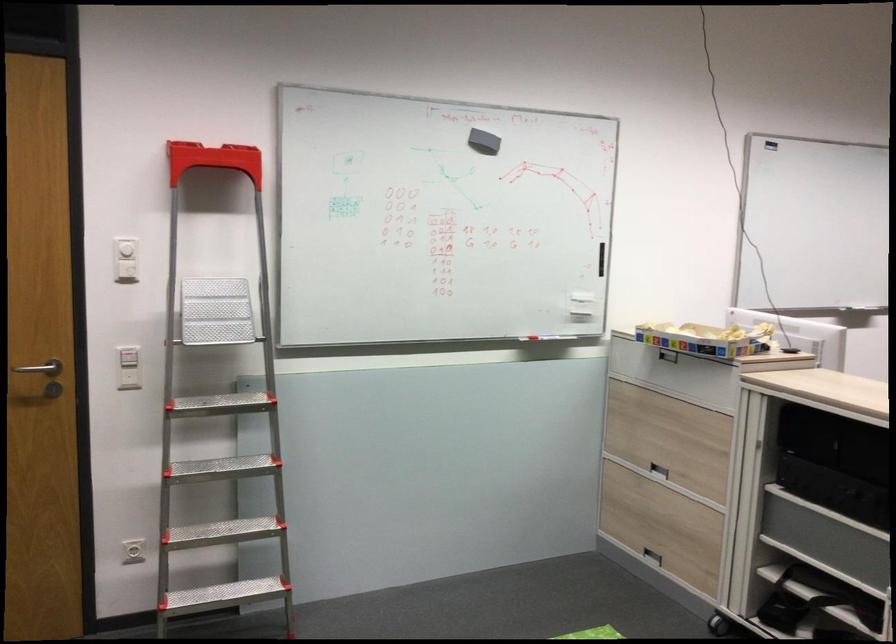
Where is `white  wall button`? The width and height of the screenshot is (896, 644). white  wall button is located at coordinates (125, 269).